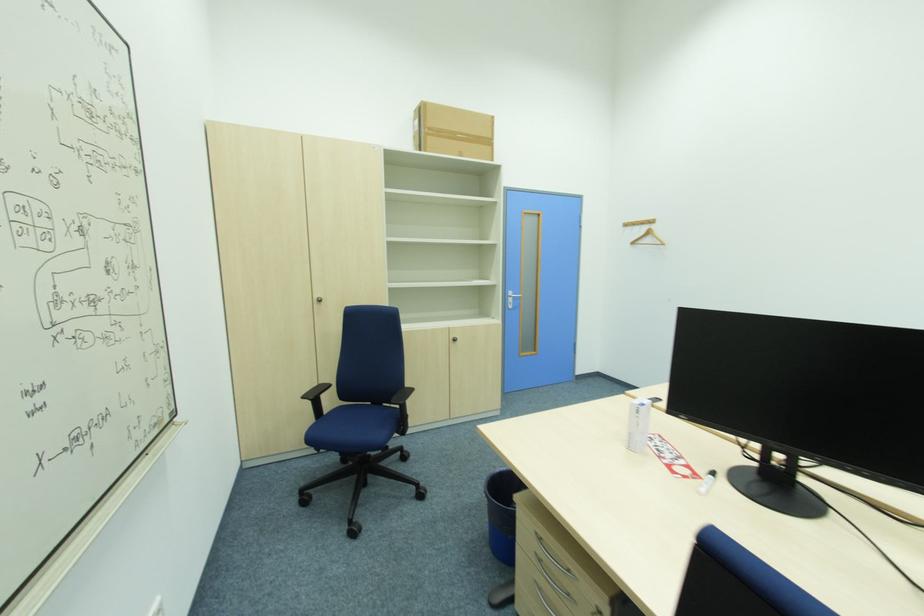
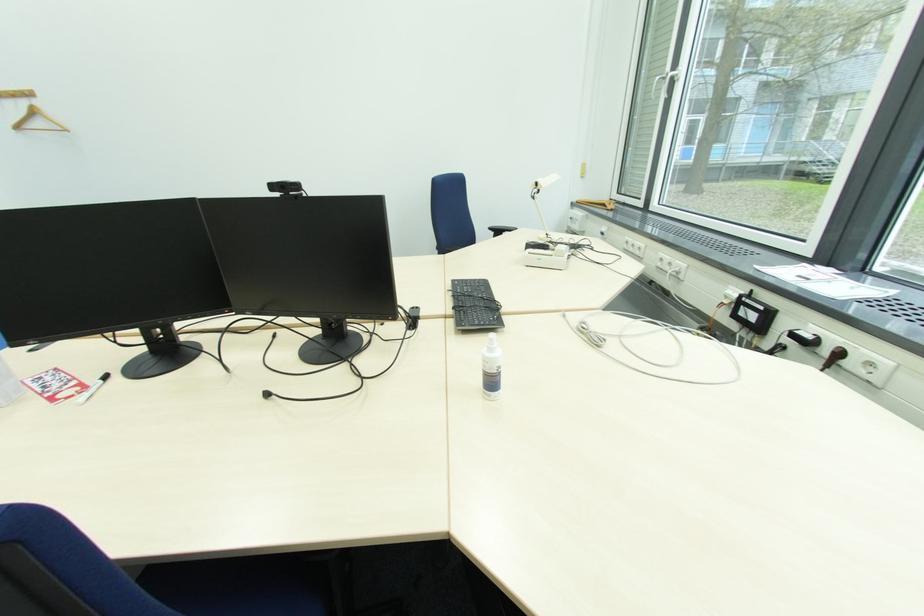
Find the pixel in the second image that matches point 650,229 in the first image.

(29, 105)